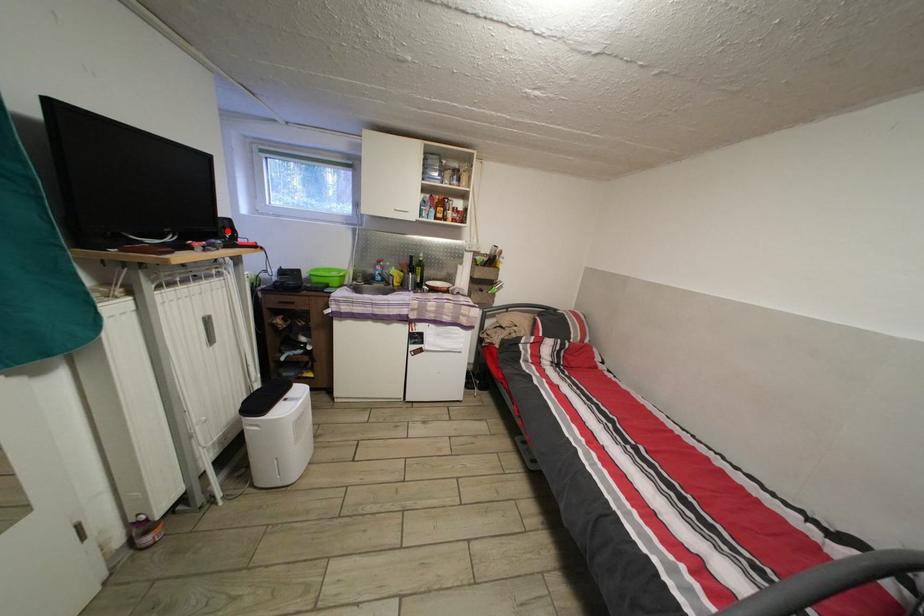
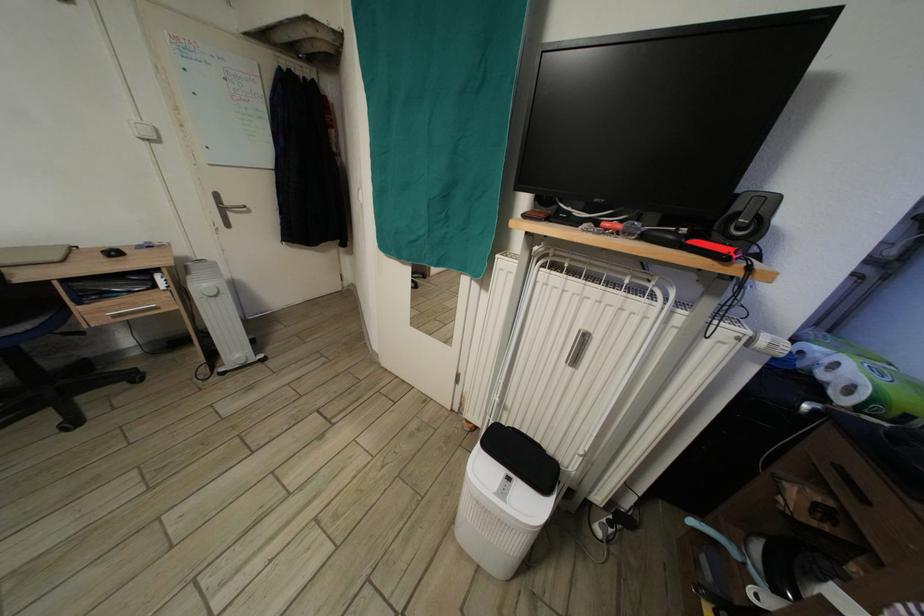
Find the pixel in the second image that matches the highlighted location in the first image.

(744, 214)